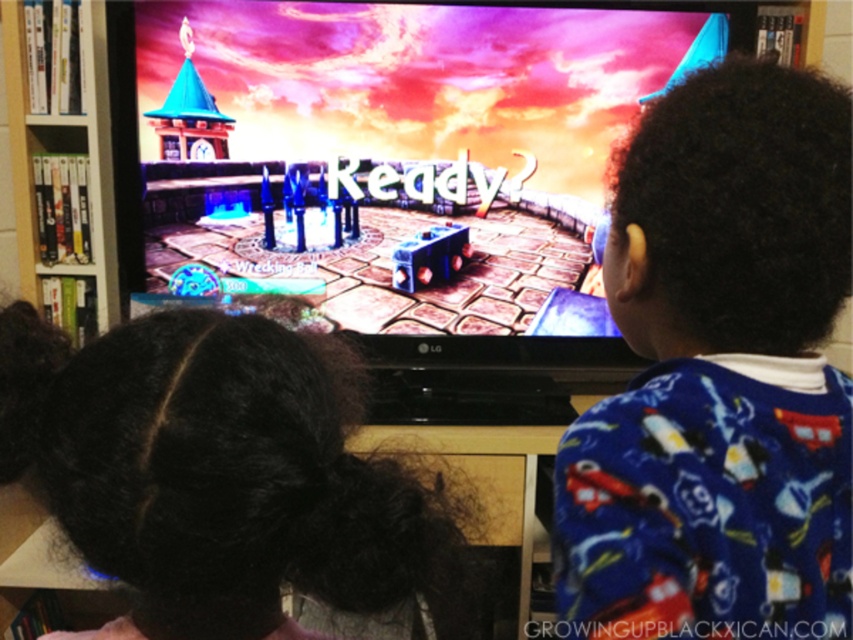
Question: Which point is closer to the camera?

Choices:
 (A) (108, 576)
 (B) (113, 218)

Answer: (A)

Question: Does blue fleece pajamas at right have a greater width compared to white glossy bookshelf at left?

Choices:
 (A) yes
 (B) no

Answer: (B)

Question: Among these objects, which one is nearest to the camera?

Choices:
 (A) blue fleece pajamas at right
 (B) white glossy bookshelf at left

Answer: (A)

Question: Does black curly hair at lower left appear over white glossy bookshelf at left?

Choices:
 (A) yes
 (B) no

Answer: (B)

Question: Which object is closer to the camera taking this photo?

Choices:
 (A) white glossy bookshelf at left
 (B) black curly hair at lower left
 (C) blue fleece pajamas at right

Answer: (B)

Question: Is black curly hair at lower left closer to the viewer compared to white glossy bookshelf at left?

Choices:
 (A) no
 (B) yes

Answer: (B)